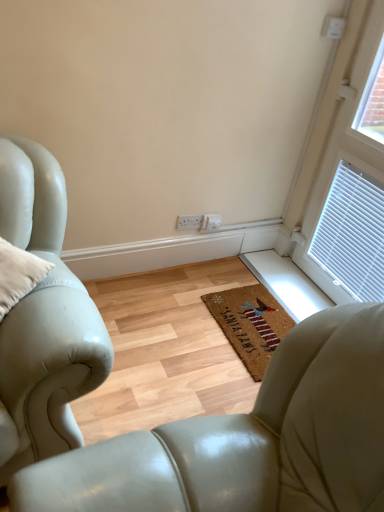
Where is `vacant space situated on the left part of coir mat at center`? The width and height of the screenshot is (384, 512). vacant space situated on the left part of coir mat at center is located at coordinates (182, 317).